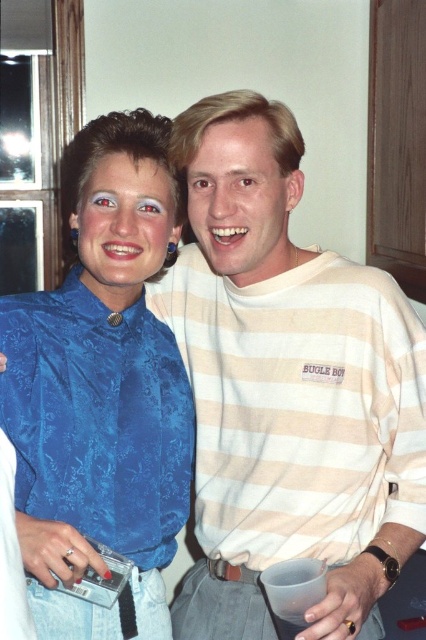
Question: Is matte beige shirt at center positioned at the back of matte blue blouse at upper left?

Choices:
 (A) no
 (B) yes

Answer: (A)

Question: Which point is farther to the camera?

Choices:
 (A) (36, 324)
 (B) (167, 227)

Answer: (B)

Question: Can you confirm if blue satin blouse at left is wider than matte beige shirt at center?

Choices:
 (A) no
 (B) yes

Answer: (B)

Question: Is blue satin blouse at left wider than matte blue blouse at upper left?

Choices:
 (A) yes
 (B) no

Answer: (A)

Question: Considering the real-world distances, which object is closest to the matte beige shirt at center?

Choices:
 (A) blue satin blouse at left
 (B) matte blue blouse at upper left

Answer: (B)

Question: Which point is farther to the camera?

Choices:
 (A) (86, 221)
 (B) (262, 141)

Answer: (A)